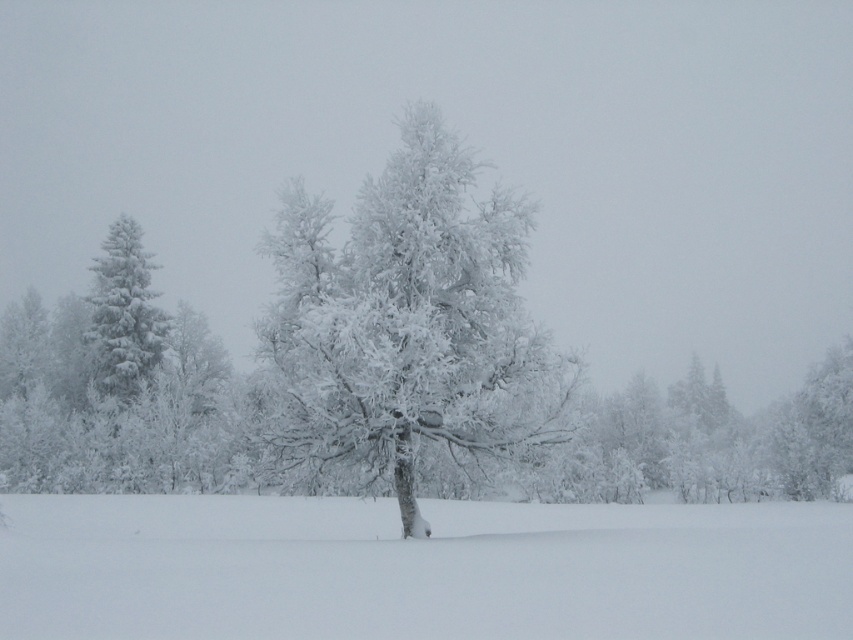
You are an observer standing in front of the winter landscape. You see the white fluffy snow at center and the white frosty tree at center. Which object is located to the left of the other?

The white fluffy snow at center is positioned on the left side of white frosty tree at center.

You are a hiker trying to estimate distances in the snow. You see the white frosty tree at center and the white frosty tree at left. How far apart are they?

The distance between the white frosty tree at center and the white frosty tree at left is 31.50 meters.